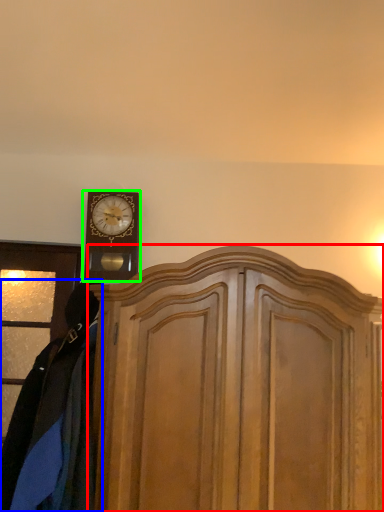
Question: Considering the real-world distances, which object is farthest from dresser (highlighted by a red box)? clothing (highlighted by a blue box) or wall clock (highlighted by a green box)?

Choices:
 (A) clothing
 (B) wall clock

Answer: (B)